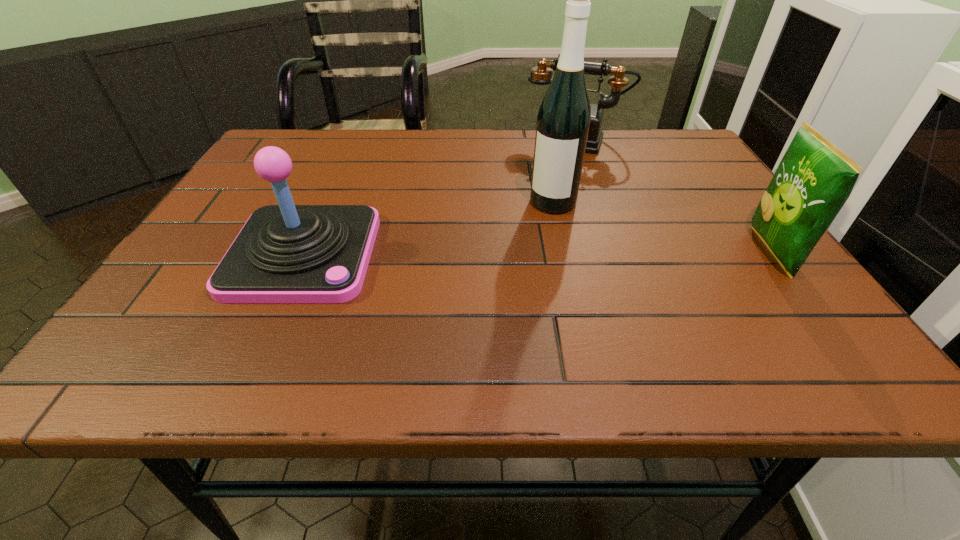
What are the coordinates of `vacant space located 0.200m on the front of the telephone at the rotary dial` in the screenshot? It's located at (548, 192).

Where is `free spot located on the front of the telephone at the rotary dial`? This screenshot has height=540, width=960. free spot located on the front of the telephone at the rotary dial is located at coordinates (532, 234).

Image resolution: width=960 pixels, height=540 pixels. Identify the location of vacant space situated 0.280m on the front of the telephone at the rotary dial. (540, 211).

The image size is (960, 540). What are the coordinates of `object positioned at the far edge` in the screenshot? It's located at (542, 74).

You are a GUI agent. You are given a task and a screenshot of the screen. Output one action in this format:
    pyautogui.click(x=<x>, y=<y>)
    Task: Click on the object at the near edge
    Image resolution: width=960 pixels, height=540 pixels.
    Given the screenshot: What is the action you would take?
    pyautogui.click(x=286, y=253)

What are the coordinates of `object that is at the left edge` in the screenshot? It's located at (286, 253).

This screenshot has height=540, width=960. I want to click on object that is at the right edge, so click(814, 179).

The image size is (960, 540). In order to click on object that is at the near left corner in this screenshot , I will do `click(286, 253)`.

This screenshot has width=960, height=540. I want to click on vacant space at the far edge of the desktop, so click(459, 133).

Locate an element on the screen. vacant space at the near edge of the desktop is located at coordinates (430, 312).